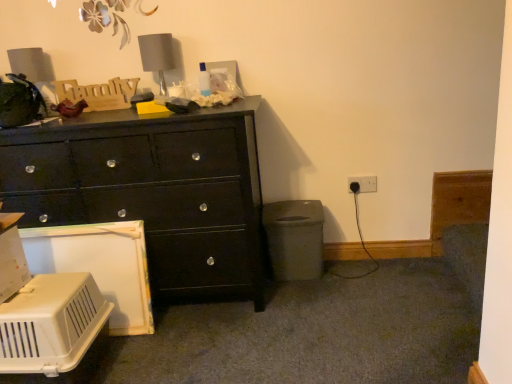
Looking at this image, measure the distance between white plastic pet carrier at lower left and camera.

The depth of white plastic pet carrier at lower left is 4.74 feet.

What do you see at coordinates (51, 324) in the screenshot? I see `white plastic pet carrier at lower left` at bounding box center [51, 324].

This screenshot has width=512, height=384. Identify the location of black glossy chest of drawers at left. (153, 191).

Are white plastic pet carrier at lower left and black glossy chest of drawers at left making contact?

No, white plastic pet carrier at lower left is not with black glossy chest of drawers at left.

From the picture: In terms of height, does white plastic pet carrier at lower left look taller or shorter compared to black glossy chest of drawers at left?

white plastic pet carrier at lower left is shorter than black glossy chest of drawers at left.

How different are the orientations of white plastic pet carrier at lower left and black glossy chest of drawers at left in degrees?

They differ by 0.557 degrees in their facing directions.

Measure the distance from white plastic pet carrier at lower left to black glossy chest of drawers at left.

They are 19.54 inches apart.

What's the angular difference between black plastic electric outlet at lower right and white plastic pet carrier at lower left's facing directions?

There is a 1.1-degree angle between the facing directions of black plastic electric outlet at lower right and white plastic pet carrier at lower left.

Considering the sizes of objects black plastic electric outlet at lower right and white plastic pet carrier at lower left in the image provided, who is taller, black plastic electric outlet at lower right or white plastic pet carrier at lower left?

With more height is white plastic pet carrier at lower left.

Considering the positions of objects black plastic electric outlet at lower right and white plastic pet carrier at lower left in the image provided, who is more to the left, black plastic electric outlet at lower right or white plastic pet carrier at lower left?

From the viewer's perspective, white plastic pet carrier at lower left appears more on the left side.

Considering the positions of point (351, 191) and point (2, 317), is point (351, 191) closer or farther from the camera than point (2, 317)?

Point (351, 191) appears to be farther away from the viewer than point (2, 317).

Is white plastic pet carrier at lower left surrounding gray fabric lampshade at upper center?

Definitely not — gray fabric lampshade at upper center is not inside white plastic pet carrier at lower left.

Considering the sizes of objects white plastic pet carrier at lower left and gray fabric lampshade at upper center in the image provided, who is wider, white plastic pet carrier at lower left or gray fabric lampshade at upper center?

white plastic pet carrier at lower left is wider.

From a real-world perspective, who is located lower, white plastic pet carrier at lower left or gray fabric lampshade at upper center?

white plastic pet carrier at lower left, from a real-world perspective.

Does black glossy chest of drawers at left touch black plastic electric outlet at lower right?

black glossy chest of drawers at left is not next to black plastic electric outlet at lower right, and they're not touching.

Considering the sizes of objects black glossy chest of drawers at left and black plastic electric outlet at lower right in the image provided, who is thinner, black glossy chest of drawers at left or black plastic electric outlet at lower right?

Thinner between the two is black plastic electric outlet at lower right.

Is black glossy chest of drawers at left located outside black plastic electric outlet at lower right?

black glossy chest of drawers at left lies outside black plastic electric outlet at lower right's area.

Which object is positioned more to the left, black glossy chest of drawers at left or black plastic electric outlet at lower right?

Positioned to the left is black glossy chest of drawers at left.

Looking at this image, can we say black glossy chest of drawers at left lies outside gray fabric lampshade at upper center?

Absolutely, black glossy chest of drawers at left is external to gray fabric lampshade at upper center.

Identify the location of table lamp above the black glossy chest of drawers at left (from the image's perspective). (157, 56).

Is black glossy chest of drawers at left next to gray fabric lampshade at upper center?

They are not placed beside each other.

From the image's perspective, relative to gray fabric lampshade at upper center, is black glossy chest of drawers at left above or below?

Based on their image positions, black glossy chest of drawers at left is located beneath gray fabric lampshade at upper center.

Is gray fabric lampshade at upper center situated inside white plastic pet carrier at lower left or outside?

gray fabric lampshade at upper center is located beyond the bounds of white plastic pet carrier at lower left.

From the image's perspective, is gray fabric lampshade at upper center on white plastic pet carrier at lower left?

Indeed, from the image's perspective, gray fabric lampshade at upper center is shown above white plastic pet carrier at lower left.

Considering the positions of points (146, 35) and (32, 357), is point (146, 35) closer to camera compared to point (32, 357)?

No, (146, 35) is behind (32, 357).

Looking at this image, does white plastic pet carrier at lower left come in front of black plastic electric outlet at lower right?

Yes, white plastic pet carrier at lower left is in front of black plastic electric outlet at lower right.

Identify the location of appliance below the black plastic electric outlet at lower right (from the image's perspective). (51, 324).

From a real-world perspective, is white plastic pet carrier at lower left physically located above or below black plastic electric outlet at lower right?

From a real-world perspective, white plastic pet carrier at lower left is physically below black plastic electric outlet at lower right.

Is black plastic electric outlet at lower right at the back of white plastic pet carrier at lower left?

No, black plastic electric outlet at lower right is not at the back of white plastic pet carrier at lower left.

You are a GUI agent. You are given a task and a screenshot of the screen. Output one action in this format:
    pyautogui.click(x=<x>, y=<y>)
    Task: Click on the chest of drawers on the right of white plastic pet carrier at lower left
    
    Given the screenshot: What is the action you would take?
    pyautogui.click(x=153, y=191)

Locate an element on the screen. The image size is (512, 384). appliance in front of the black plastic electric outlet at lower right is located at coordinates (51, 324).

Estimate the real-world distances between objects in this image. Which object is further from gray fabric lampshade at upper center, black glossy chest of drawers at left or black plastic electric outlet at lower right?

black plastic electric outlet at lower right.

From the image, which object appears to be farther from black plastic electric outlet at lower right, gray fabric lampshade at upper center or black glossy chest of drawers at left?

gray fabric lampshade at upper center is positioned further to the anchor black plastic electric outlet at lower right.

When comparing their distances from black glossy chest of drawers at left, does white plastic pet carrier at lower left or gray fabric lampshade at upper center seem further?

gray fabric lampshade at upper center lies further to black glossy chest of drawers at left than the other object.

Looking at the image, which one is located further to white plastic pet carrier at lower left, black glossy chest of drawers at left or gray fabric lampshade at upper center?

gray fabric lampshade at upper center is positioned further to the anchor white plastic pet carrier at lower left.

In the scene shown: From the image, which object appears to be farther from black glossy chest of drawers at left, black plastic electric outlet at lower right or white plastic pet carrier at lower left?

Among the two, black plastic electric outlet at lower right is located further to black glossy chest of drawers at left.

Considering their positions, is black plastic electric outlet at lower right positioned closer to gray fabric lampshade at upper center than black glossy chest of drawers at left?

Among the two, black glossy chest of drawers at left is located nearer to gray fabric lampshade at upper center.

Considering their positions, is white plastic pet carrier at lower left positioned further to gray fabric lampshade at upper center than black plastic electric outlet at lower right?

black plastic electric outlet at lower right is further to gray fabric lampshade at upper center.

Estimate the real-world distances between objects in this image. Which object is further from black plastic electric outlet at lower right, black glossy chest of drawers at left or gray fabric lampshade at upper center?

gray fabric lampshade at upper center.

This screenshot has height=384, width=512. I want to click on chest of drawers between white plastic pet carrier at lower left and black plastic electric outlet at lower right, so pos(153,191).

Identify the location of table lamp between white plastic pet carrier at lower left and black plastic electric outlet at lower right from left to right. The width and height of the screenshot is (512, 384). (157, 56).

Where is `the chest of drawers between gray fabric lampshade at upper center and white plastic pet carrier at lower left vertically`? The width and height of the screenshot is (512, 384). the chest of drawers between gray fabric lampshade at upper center and white plastic pet carrier at lower left vertically is located at coordinates click(153, 191).

I want to click on table lamp situated between black glossy chest of drawers at left and black plastic electric outlet at lower right from left to right, so click(157, 56).